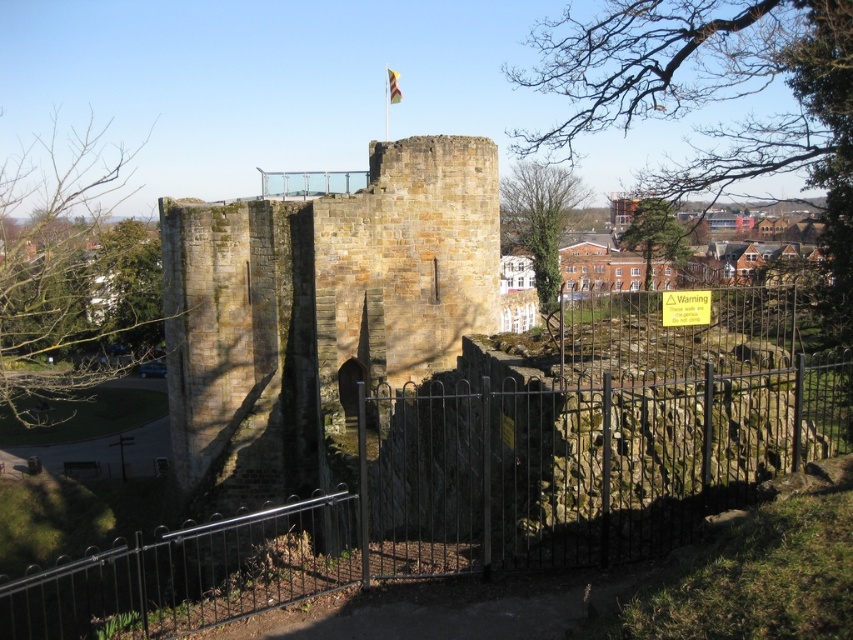
You are a visitor approaching the historic stone structure. You notice the black wrought iron gate at center and the yellow fabric flag at center. Which object is taller?

The yellow fabric flag at center is taller than the black wrought iron gate at center.

You are a historian examining the image of the historic stone structure. You notice both the brown stone ruins at center and the yellow fabric flag at center. Based on their sizes, which object would appear closer to the observer?

The yellow fabric flag at center appears larger than the brown stone ruins at center, so it would seem closer to the observer due to its size.

You are a tourist standing at the base of the historic stone structure. You want to take a photo of the brown stone ruins at center without the black wrought iron gate at center blocking the view. Is it possible to position yourself in a way that the gate does not obscure the ruins?

The black wrought iron gate at center is closer to the viewer than the brown stone ruins at center. Therefore, if you position yourself so that the gate is not between you and the ruins, you can take a photo without the gate blocking the view. Alternatively, moving to the side might allow you to frame the shot so the gate is out of the way.